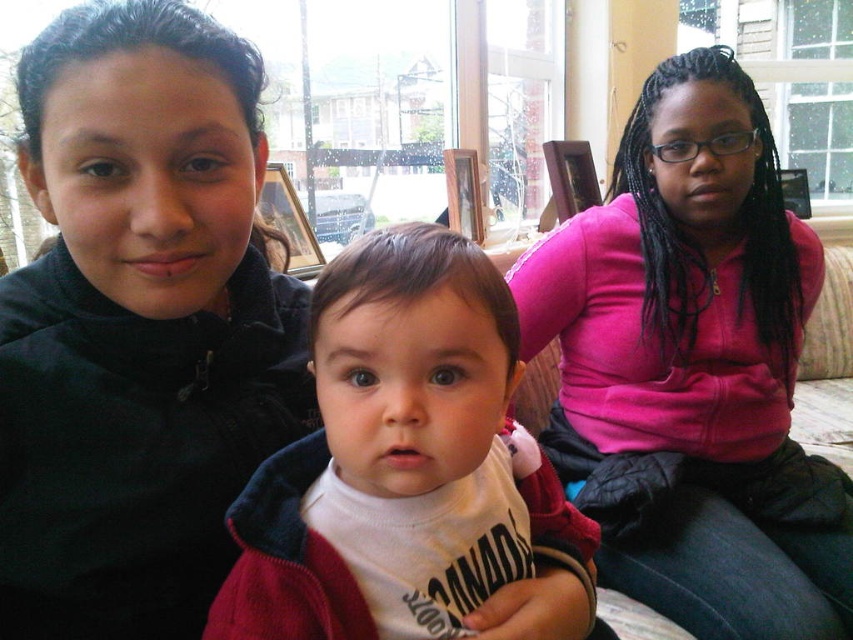
Question: Which of the following is the farthest from the observer?

Choices:
 (A) (514, 435)
 (B) (785, 209)

Answer: (B)

Question: Does pink fleece at center come behind white soft fabric at center?

Choices:
 (A) no
 (B) yes

Answer: (B)

Question: Is pink fleece at center to the right of white soft fabric at center from the viewer's perspective?

Choices:
 (A) yes
 (B) no

Answer: (A)

Question: Which of the following is the farthest from the observer?

Choices:
 (A) pink fleece at center
 (B) white soft fabric at center

Answer: (A)

Question: Which object is farther from the camera taking this photo?

Choices:
 (A) white soft fabric at center
 (B) pink fleece at center

Answer: (B)

Question: In this image, where is pink fleece at center located relative to white soft fabric at center?

Choices:
 (A) right
 (B) left

Answer: (A)